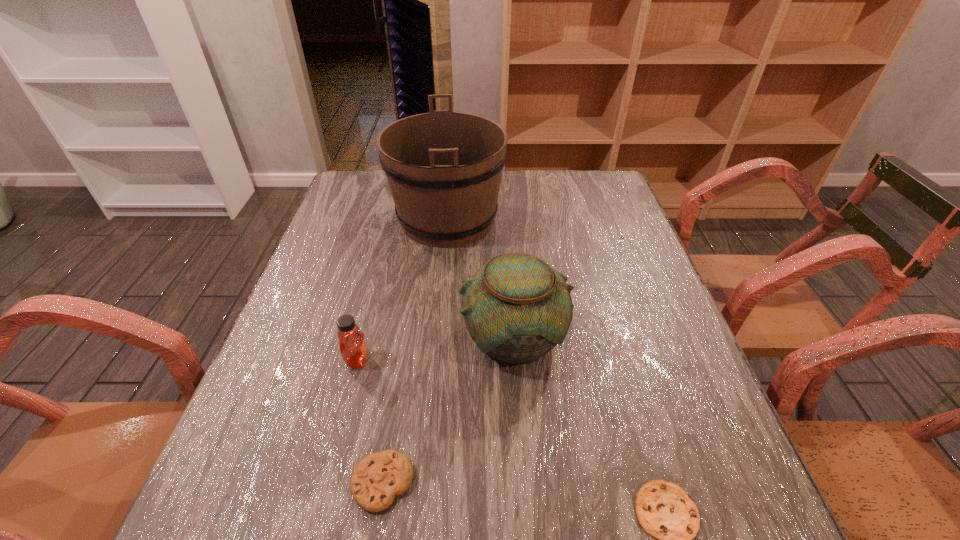
Identify the location of bucket. The width and height of the screenshot is (960, 540). (444, 168).

This screenshot has width=960, height=540. Find the location of `the tallest object`. the tallest object is located at coordinates (444, 168).

You are a GUI agent. You are given a task and a screenshot of the screen. Output one action in this format:
    pyautogui.click(x=<x>, y=<y>)
    Task: Click on the second tallest object
    
    Given the screenshot: What is the action you would take?
    pyautogui.click(x=516, y=307)

Where is `the third tallest object`? the third tallest object is located at coordinates (353, 350).

The image size is (960, 540). Identify the location of the second shortest object. (379, 477).

The width and height of the screenshot is (960, 540). In order to click on the left cookie in this screenshot , I will do `click(379, 477)`.

Find the location of a particular element. This screenshot has width=960, height=540. vacant area situated on the right of the bucket is located at coordinates coord(549,219).

In order to click on vacant space located on the left of the second tallest object in this screenshot , I will do [345, 335].

At what (x,y) coordinates should I click in order to perform the action: click on free space located 0.100m on the front label of the third tallest object. Please return your answer as a coordinate pair (x, y). Image resolution: width=960 pixels, height=540 pixels. Looking at the image, I should click on (419, 360).

This screenshot has height=540, width=960. In order to click on free space located on the right of the left cookie in this screenshot , I will do `click(618, 482)`.